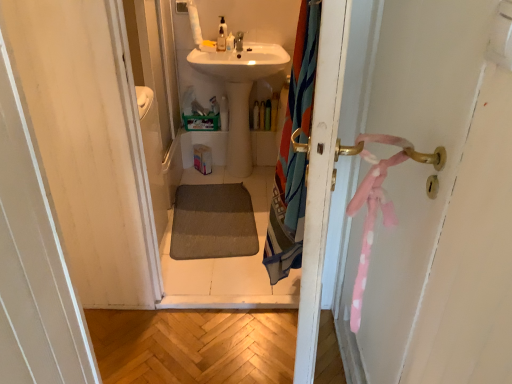
What do you see at coordinates (262, 115) in the screenshot? I see `translucent plastic bottle at center, which is the 4th toiletry in front-to-back order` at bounding box center [262, 115].

How much space does translucent plastic soap dispenser at upper center, which is counted as the 3th toiletry, starting from the right, occupy vertically?

translucent plastic soap dispenser at upper center, which is counted as the 3th toiletry, starting from the right, is 10.14 centimeters in height.

This screenshot has height=384, width=512. Describe the element at coordinates (320, 178) in the screenshot. I see `multicolored fabric shower curtain at right` at that location.

At what (x,y) coordinates should I click in order to perform the action: click on translucent plastic soap dispenser at upper center, the fourth toiletry from the right. Please return your answer as a coordinate pair (x, y). Looking at the image, I should click on (221, 40).

Where is `translucent plastic bottle at center, which is the 4th toiletry in front-to-back order`? translucent plastic bottle at center, which is the 4th toiletry in front-to-back order is located at coordinates (262, 115).

Is matte white faucet at upper center in front of or behind translucent plastic soap dispenser at upper center, which is counted as the 2th toiletry, starting from the left, in the image?

Visually, matte white faucet at upper center is located in front of translucent plastic soap dispenser at upper center, which is counted as the 2th toiletry, starting from the left.

In terms of size, does matte white faucet at upper center appear bigger or smaller than translucent plastic soap dispenser at upper center, arranged as the 2th toiletry when viewed from the front?

Clearly, matte white faucet at upper center is larger in size than translucent plastic soap dispenser at upper center, arranged as the 2th toiletry when viewed from the front.

Considering the sizes of objects matte white faucet at upper center and translucent plastic soap dispenser at upper center, which is counted as the fourth toiletry, starting from the bottom, in the image provided, who is wider, matte white faucet at upper center or translucent plastic soap dispenser at upper center, which is counted as the fourth toiletry, starting from the bottom,?

Wider between the two is matte white faucet at upper center.

Which is correct: matte white faucet at upper center is inside translucent plastic soap dispenser at upper center, the third toiletry in the back-to-front sequence, or outside of it?

The correct answer is: outside.

Would you say matte white faucet at upper center is to the left or to the right of translucent plastic bottle at center, which is counted as the second toiletry, starting from the bottom, in the picture?

Based on their positions, matte white faucet at upper center is located to the left of translucent plastic bottle at center, which is counted as the second toiletry, starting from the bottom.

Find the location of `tap on the left side of translucent plastic bottle at center, which is the 1th toiletry from back to front`. tap on the left side of translucent plastic bottle at center, which is the 1th toiletry from back to front is located at coordinates (239, 41).

Between point (237, 41) and point (264, 110), which one is positioned behind?

Positioned behind is point (264, 110).

Which object is further away from the camera, translucent plastic bottle at center, acting as the first toiletry starting from the right, or translucent plastic soap dispenser at upper center, the 4th toiletry positioned from the back?

translucent plastic bottle at center, acting as the first toiletry starting from the right, is further from the camera.

Which is nearer, (259, 121) or (221, 32)?

The point (221, 32) is more forward.

Is translucent plastic soap dispenser at upper center, which is the 2th toiletry from top to bottom, surrounded by translucent plastic bottle at center, which is the 1th toiletry from back to front?

No, translucent plastic soap dispenser at upper center, which is the 2th toiletry from top to bottom, is not inside translucent plastic bottle at center, which is the 1th toiletry from back to front.

From a real-world perspective, is translucent plastic bottle at center, acting as the third toiletry starting from the top, positioned under translucent plastic soap dispenser at upper center, which is the first toiletry from left to right, based on gravity?

Yes, from a real-world perspective, translucent plastic bottle at center, acting as the third toiletry starting from the top, is below translucent plastic soap dispenser at upper center, which is the first toiletry from left to right.

Which object is positioned more to the right, matte white faucet at upper center or multicolored fabric shower curtain at right?

multicolored fabric shower curtain at right.

Considering the relative positions of matte white faucet at upper center and multicolored fabric shower curtain at right in the image provided, is matte white faucet at upper center in front of multicolored fabric shower curtain at right?

No, it is not.

Considering the positions of point (237, 48) and point (335, 73), is point (237, 48) closer or farther from the camera than point (335, 73)?

Point (237, 48).

Does matte white faucet at upper center have a larger size compared to multicolored fabric shower curtain at right?

No.

Is matte white faucet at upper center wider or thinner than translucent plastic bottle at center, positioned as the first toiletry in bottom-to-top order?

matte white faucet at upper center is thinner than translucent plastic bottle at center, positioned as the first toiletry in bottom-to-top order.

From a real-world perspective, is matte white faucet at upper center physically above translucent plastic bottle at center, which ranks as the third toiletry in front-to-back order?

Correct, in the physical world, matte white faucet at upper center is higher than translucent plastic bottle at center, which ranks as the third toiletry in front-to-back order.

Considering the sizes of objects matte white faucet at upper center and translucent plastic bottle at center, placed as the 2th toiletry when sorted from back to front, in the image provided, who is taller, matte white faucet at upper center or translucent plastic bottle at center, placed as the 2th toiletry when sorted from back to front,?

Standing taller between the two is translucent plastic bottle at center, placed as the 2th toiletry when sorted from back to front.

Could you measure the distance between translucent plastic bottle at center, which is the third toiletry from left to right, and translucent plastic bottle at center, which is counted as the 4th toiletry, starting from the left?

2.91 centimeters.

In the scene shown: Considering the relative sizes of translucent plastic bottle at center, which is the third toiletry from left to right, and translucent plastic bottle at center, acting as the third toiletry starting from the top, in the image provided, is translucent plastic bottle at center, which is the third toiletry from left to right, thinner than translucent plastic bottle at center, acting as the third toiletry starting from the top,?

In fact, translucent plastic bottle at center, which is the third toiletry from left to right, might be wider than translucent plastic bottle at center, acting as the third toiletry starting from the top.

Who is shorter, translucent plastic bottle at center, the second toiletry positioned from the right, or translucent plastic bottle at center, which is counted as the second toiletry, starting from the bottom?

translucent plastic bottle at center, the second toiletry positioned from the right.

Can translucent plastic bottle at center, which is counted as the 4th toiletry, starting from the left, be found inside translucent plastic bottle at center, acting as the fourth toiletry starting from the top?

Definitely not — translucent plastic bottle at center, which is counted as the 4th toiletry, starting from the left, is not inside translucent plastic bottle at center, acting as the fourth toiletry starting from the top.

Image resolution: width=512 pixels, height=384 pixels. What are the coordinates of `the 1st toiletry counting from the left side of the multicolored fabric shower curtain at right` in the screenshot? It's located at coord(262,115).

Is translucent plastic bottle at center, acting as the first toiletry starting from the right, not near multicolored fabric shower curtain at right?

translucent plastic bottle at center, acting as the first toiletry starting from the right, is positioned a significant distance from multicolored fabric shower curtain at right.

Between point (264, 103) and point (300, 344), which one is positioned behind?

The point (264, 103) is farther from the camera.

Is translucent plastic bottle at center, acting as the first toiletry starting from the right, wider than multicolored fabric shower curtain at right?

Correct, the width of translucent plastic bottle at center, acting as the first toiletry starting from the right, exceeds that of multicolored fabric shower curtain at right.

The image size is (512, 384). I want to click on tap in front of the translucent plastic soap dispenser at upper center, the 1th toiletry positioned from the top, so click(x=239, y=41).

What are the coordinates of `tap located above the translucent plastic bottle at center, which is counted as the 4th toiletry, starting from the left (from the image's perspective)` in the screenshot? It's located at (239, 41).

Considering their positions, is translucent plastic soap dispenser at upper center, arranged as the 2th toiletry when viewed from the front, positioned closer to translucent plastic bottle at center, positioned as the first toiletry in bottom-to-top order, than translucent plastic bottle at center, which is the 1th toiletry from back to front?

translucent plastic bottle at center, which is the 1th toiletry from back to front.

Which object lies nearer to the anchor point translucent plastic soap dispenser at upper center, which is counted as the 3th toiletry, starting from the right, translucent plastic soap dispenser at upper center, which is counted as the 1th toiletry, starting from the front, or white glossy sink at center?

translucent plastic soap dispenser at upper center, which is counted as the 1th toiletry, starting from the front, is closer to translucent plastic soap dispenser at upper center, which is counted as the 3th toiletry, starting from the right.

When comparing their distances from matte white faucet at upper center, does translucent plastic soap dispenser at upper center, which appears as the third toiletry when ordered from the bottom, or white glossy sink at center seem closer?

translucent plastic soap dispenser at upper center, which appears as the third toiletry when ordered from the bottom, is positioned closer to the anchor matte white faucet at upper center.

From the image, which object appears to be farther from translucent plastic soap dispenser at upper center, arranged as the 2th toiletry when viewed from the front, matte white faucet at upper center or white glossy sink at center?

Based on the image, white glossy sink at center appears to be further to translucent plastic soap dispenser at upper center, arranged as the 2th toiletry when viewed from the front.

From the image, which object appears to be nearer to translucent plastic bottle at center, which is counted as the second toiletry, starting from the bottom, white glossy sink at center or matte white faucet at upper center?

white glossy sink at center.

Which object lies further to the anchor point translucent plastic bottle at center, acting as the first toiletry starting from the right, translucent plastic bottle at center, acting as the fourth toiletry starting from the top, or multicolored fabric shower curtain at right?

Based on the image, multicolored fabric shower curtain at right appears to be further to translucent plastic bottle at center, acting as the first toiletry starting from the right.

When comparing their distances from white glossy sink at center, does translucent plastic soap dispenser at upper center, which appears as the third toiletry when ordered from the bottom, or translucent plastic soap dispenser at upper center, the 1th toiletry positioned from the top, seem closer?

translucent plastic soap dispenser at upper center, the 1th toiletry positioned from the top.

Which object lies further to the anchor point translucent plastic soap dispenser at upper center, the third toiletry in the back-to-front sequence, white glossy sink at center or translucent plastic soap dispenser at upper center, which is the 2th toiletry from top to bottom?

The object further to translucent plastic soap dispenser at upper center, the third toiletry in the back-to-front sequence, is white glossy sink at center.

Find the location of a particular element. tap between translucent plastic soap dispenser at upper center, which is counted as the 1th toiletry, starting from the front, and translucent plastic bottle at center, placed as the 2th toiletry when sorted from back to front, in the up-down direction is located at coordinates (239, 41).

The image size is (512, 384). Find the location of `toiletry between matte white faucet at upper center and translucent plastic bottle at center, positioned as the first toiletry in bottom-to-top order, in the vertical direction`. toiletry between matte white faucet at upper center and translucent plastic bottle at center, positioned as the first toiletry in bottom-to-top order, in the vertical direction is located at coordinates (262, 115).

Locate an element on the screen. The width and height of the screenshot is (512, 384). toiletry between translucent plastic soap dispenser at upper center, which is counted as the 1th toiletry, starting from the front, and translucent plastic bottle at center, placed as the 2th toiletry when sorted from back to front, from top to bottom is located at coordinates (262, 115).

You are a GUI agent. You are given a task and a screenshot of the screen. Output one action in this format:
    pyautogui.click(x=<x>, y=<y>)
    Task: Click on the sink positioned between multicolored fabric shower curtain at right and matte white faucet at upper center from near to far
    Image resolution: width=512 pixels, height=384 pixels.
    Given the screenshot: What is the action you would take?
    point(240,91)